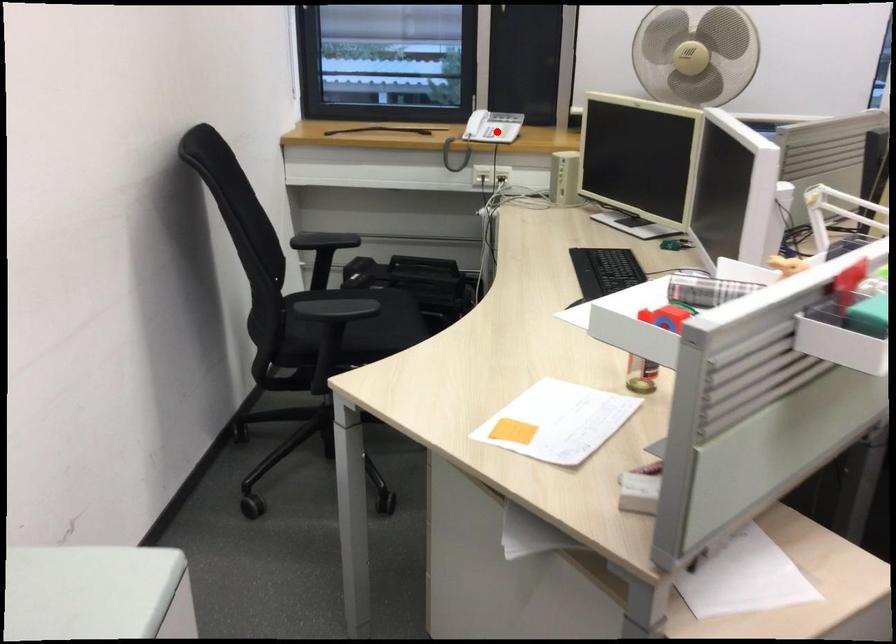
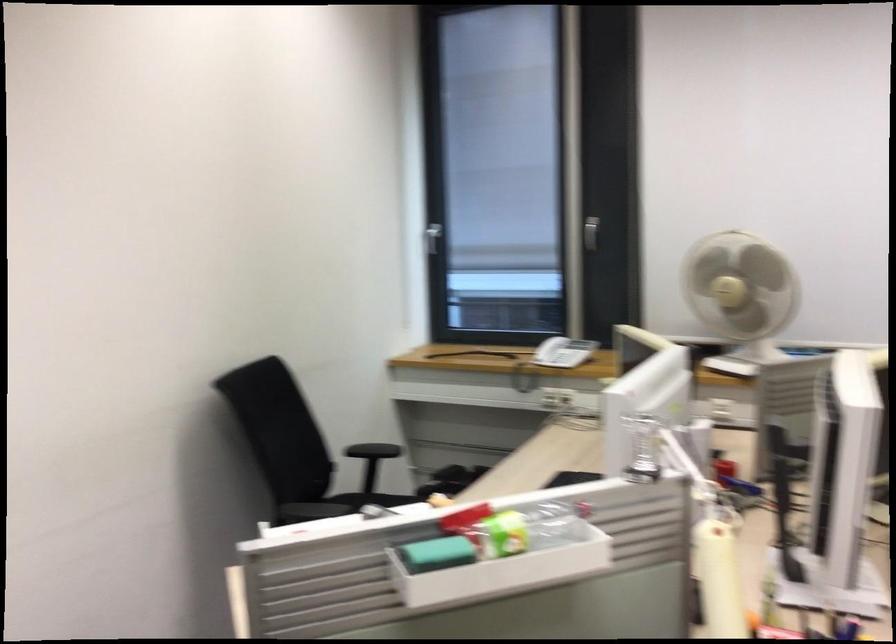
Find the pixel in the second image that matches the highlighted location in the first image.

(563, 352)